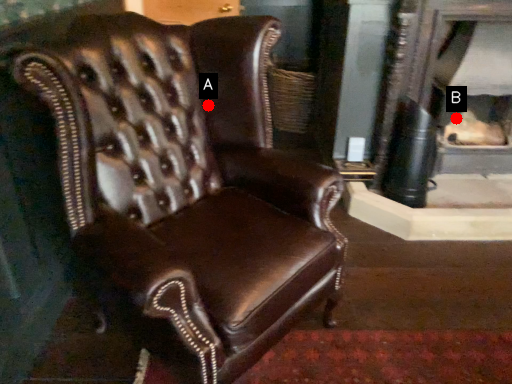
Question: Two points are circled on the image, labeled by A and B beside each circle. Which point is closer to the camera taking this photo?

Choices:
 (A) A is closer
 (B) B is closer

Answer: (A)